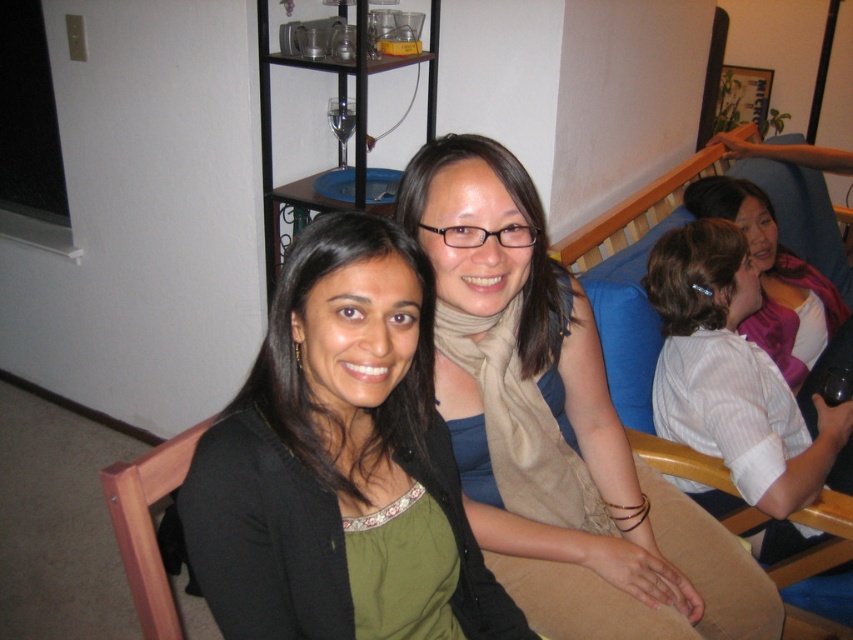
You are standing in the room and want to hand a gift to the person wearing the beige scarf at center without disturbing the person in the white striped shirt at right. Which direction should you approach from?

You should approach from the left side because the beige scarf at center is to the left of the white striped shirt at right, so approaching from the left would avoid the person in the white striped shirt at right.

You are standing in the room and want to locate the matte black sweater at center. According to the coordinates given, where should you look relative to the center of the image?

The matte black sweater at center is located at coordinates point 0.722 on the x axis and 0.399 on the y axis, so you should look slightly to the right and slightly above the center of the image.